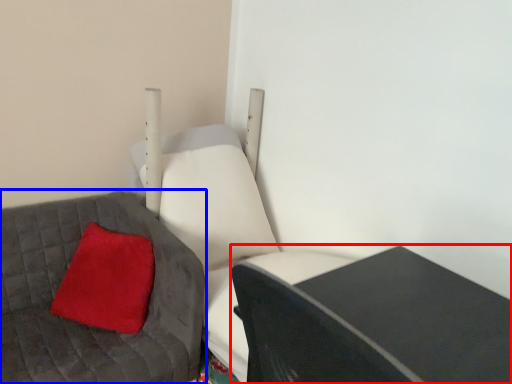
Question: Which of the following is the farthest to the observer, table (highlighted by a red box) or furniture (highlighted by a blue box)?

Choices:
 (A) table
 (B) furniture

Answer: (B)